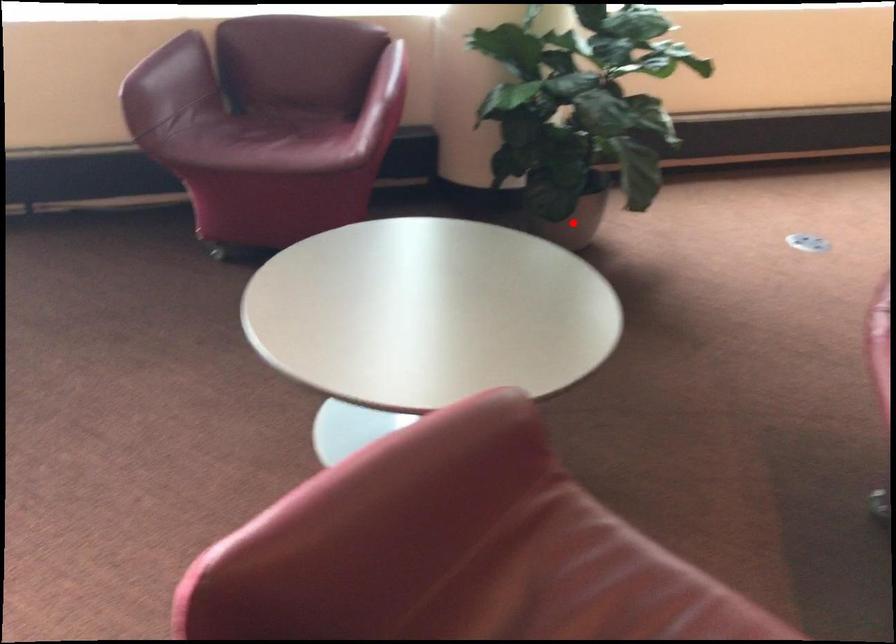
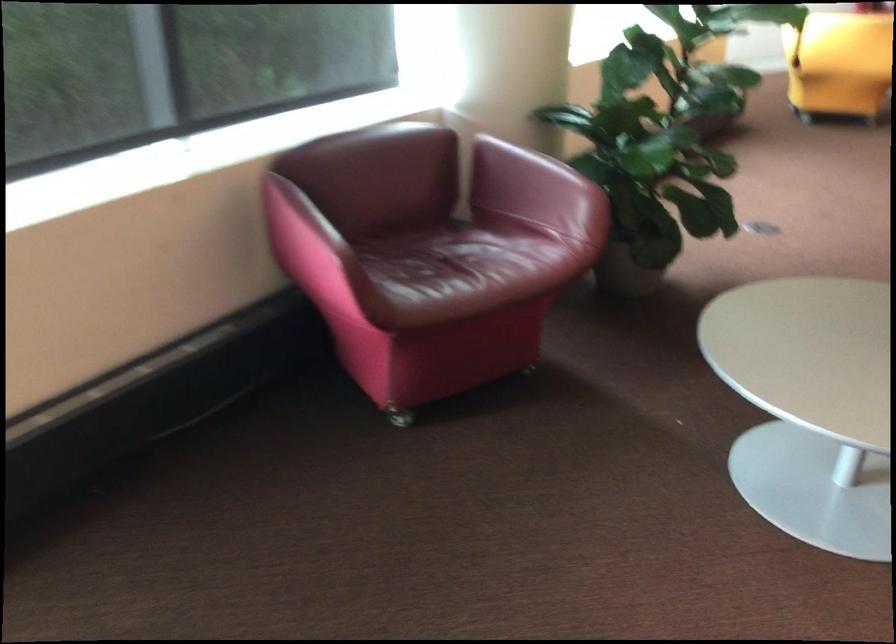
Question: I am providing you with two images of the same scene from different viewpoints. A red point is marked on the first image. Is the red point's position out of view in image 2?

Choices:
 (A) Yes
 (B) No

Answer: (A)